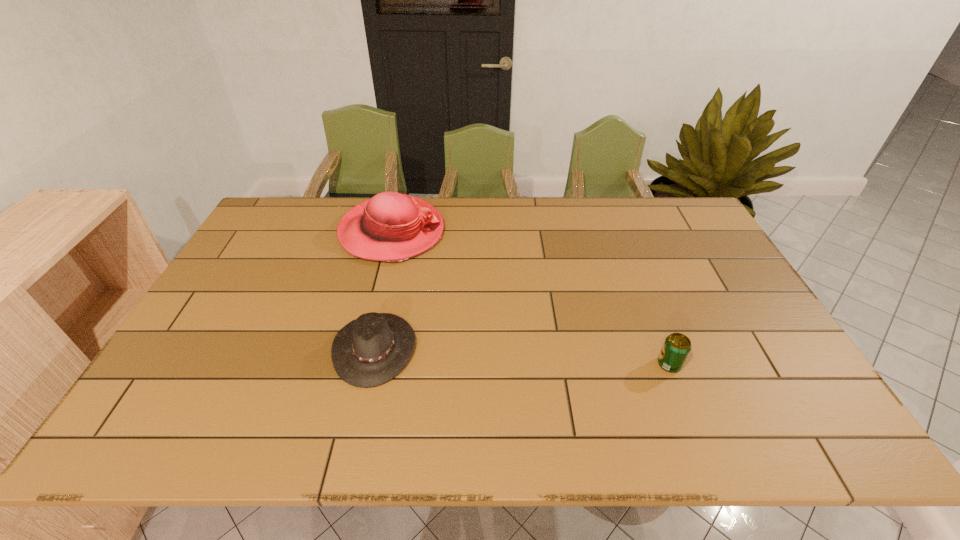
Find the location of a particular element. The height and width of the screenshot is (540, 960). free space that satisfies the following two spatial constraints: 1. on the back side of the beer can; 2. at the front of the tallest object with a bow is located at coordinates (617, 232).

The image size is (960, 540). What are the coordinates of `vacant space that satisfies the following two spatial constraints: 1. on the front-facing side of the rightmost object; 2. on the left side of the shorter hat` in the screenshot? It's located at (372, 364).

Where is `vacant point that satisfies the following two spatial constraints: 1. on the front-facing side of the nearer hat; 2. on the back side of the rightmost object`? This screenshot has width=960, height=540. vacant point that satisfies the following two spatial constraints: 1. on the front-facing side of the nearer hat; 2. on the back side of the rightmost object is located at coordinates (372, 364).